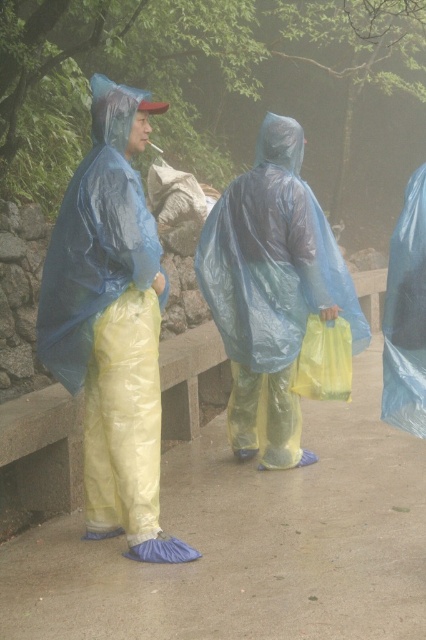
Consider the image. Can you confirm if matte blue raincoat at left is smaller than transparent plastic poncho at center?

Yes, matte blue raincoat at left is smaller than transparent plastic poncho at center.

Is matte blue raincoat at left further to the viewer compared to transparent plastic poncho at center?

No, it is in front of transparent plastic poncho at center.

Identify the location of matte blue raincoat at left. (112, 324).